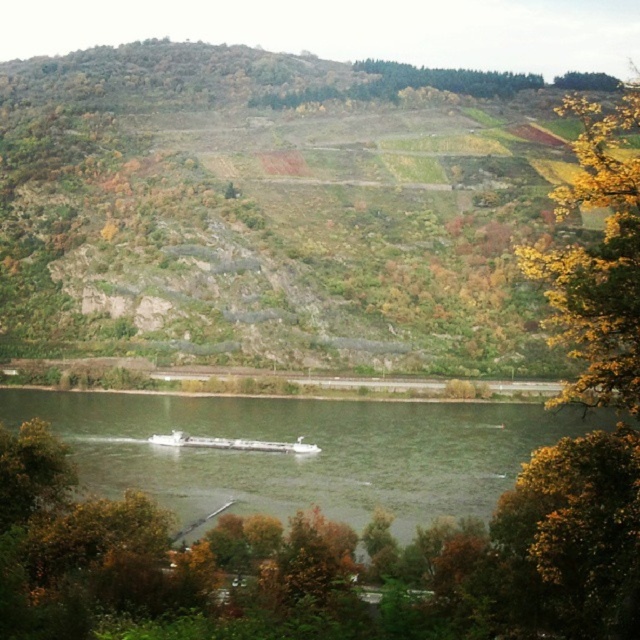
Between green grassy hillside at center and greenish-gray water at center, which one has less height?

With less height is greenish-gray water at center.

Does green grassy hillside at center have a larger size compared to greenish-gray water at center?

Correct, green grassy hillside at center is larger in size than greenish-gray water at center.

Who is more forward, (476, 278) or (132, 436)?

Point (132, 436)

Locate an element on the screen. This screenshot has height=640, width=640. green grassy hillside at center is located at coordinates (273, 209).

Consider the image. Does yellow leafy tree at upper right have a lesser height compared to white matte barge at lower center?

No.

You are a GUI agent. You are given a task and a screenshot of the screen. Output one action in this format:
    pyautogui.click(x=<x>, y=<y>)
    Task: Click on the yellow leafy tree at upper right
    Image resolution: width=640 pixels, height=640 pixels.
    Given the screenshot: What is the action you would take?
    pyautogui.click(x=596, y=259)

Measure the distance between point [556,109] and camera.

Point [556,109] is 301.59 meters away from camera.

Locate an element on the screen. Image resolution: width=640 pixels, height=640 pixels. yellow leafy tree at upper right is located at coordinates (596, 259).

In the scene shown: Between green grassy hillside at center and white matte barge at lower center, which one has less height?

With less height is white matte barge at lower center.

Who is higher up, green grassy hillside at center or white matte barge at lower center?

green grassy hillside at center is above.

Where is `green grassy hillside at center`? This screenshot has height=640, width=640. green grassy hillside at center is located at coordinates (273, 209).